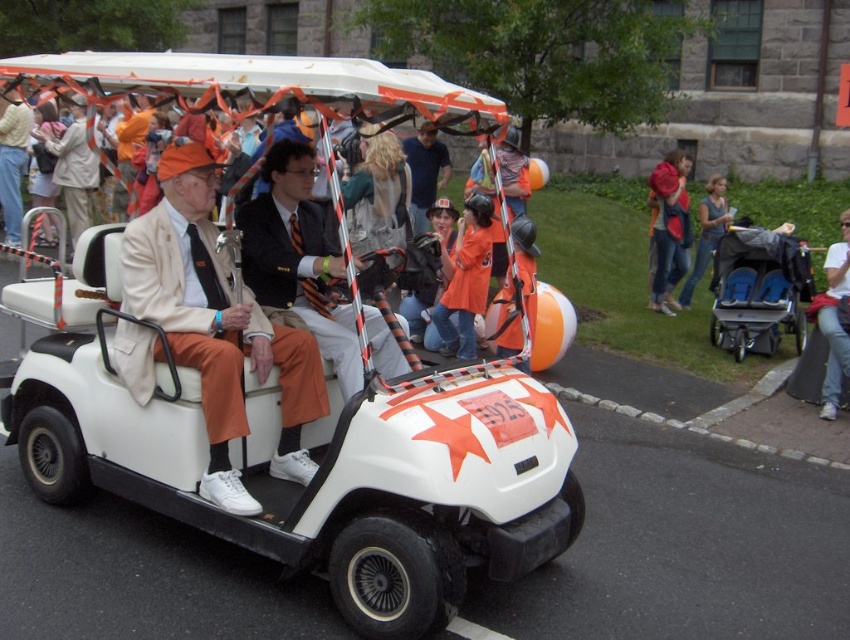
You are standing at the back of the golf cart and want to hand a flower to the person closest to you. Which point, point (428, 563) or point (173, 189), corresponds to the location of the person you should give the flower to?

Point (173, 189) corresponds to the person closer to you at the back of the golf cart. Since point (428, 563) is in front of point (173, 189), the person at point (173, 189) is nearer to your position at the back.

You are a photographer standing at the edge of the parade route. You need to capture a photo where both the white matte golf cart at center and the jeans at lower right are visible. Considering their heights, which object should be placed closer to the camera to ensure both are fully visible in the frame?

The white matte golf cart at center is taller than the jeans at lower right. To ensure both are fully visible, the taller object, the white matte golf cart at center, should be placed closer to the camera so that the shorter jeans at lower right can be seen without being obscured by the cart.

You are standing at the origin point of the coordinate system in the image. The white matte golf cart at center is represented by point (280,420). What is the coordinate of the white matte golf cart at center?

The coordinate of the white matte golf cart at center is point (280,420).